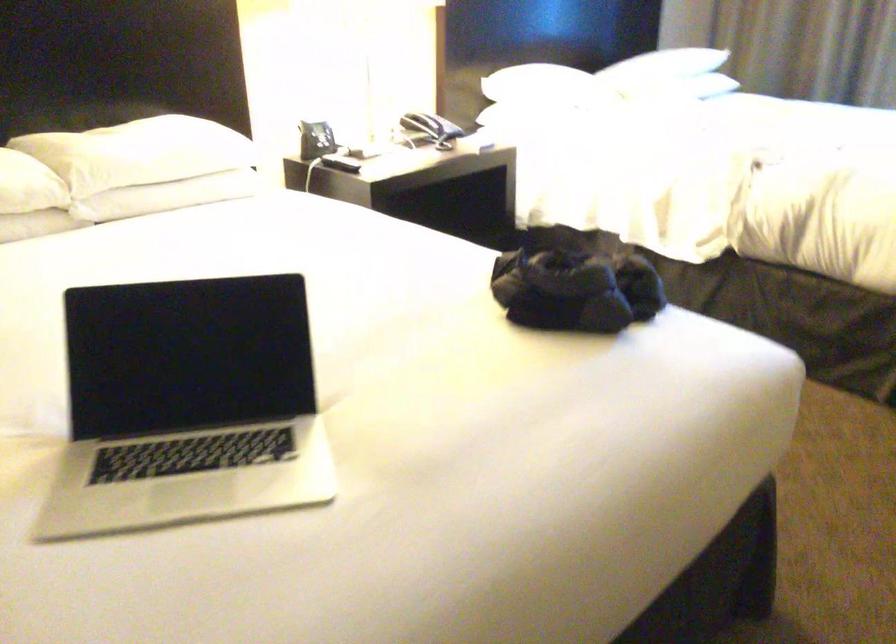
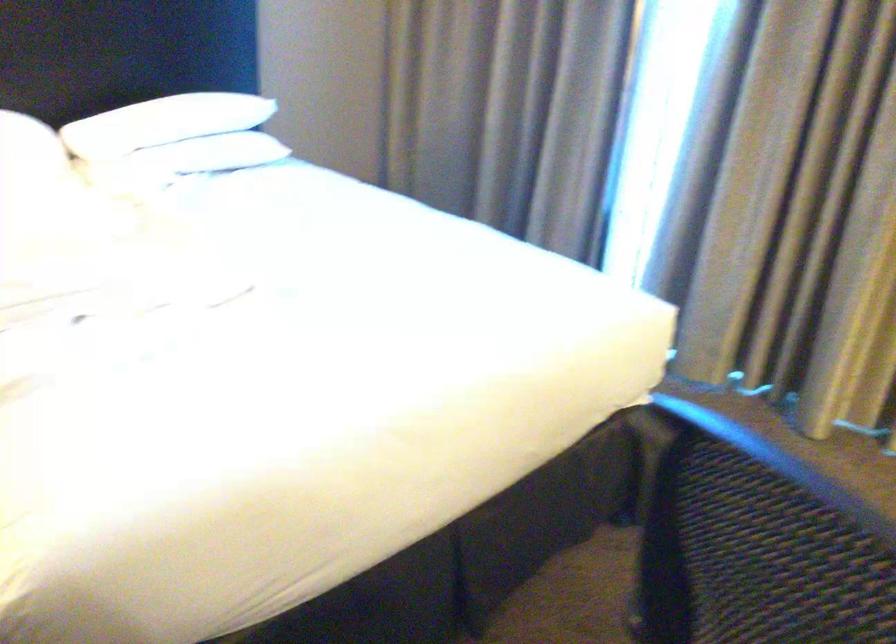
Where in the second image is the point corresponding to point 707,73 from the first image?

(203, 155)